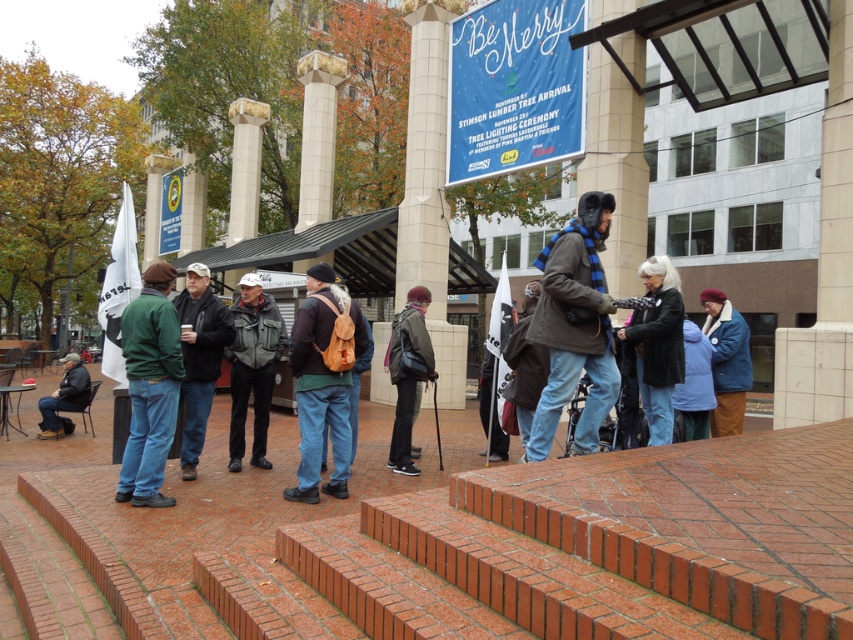
You are standing at the bottom of the brick steps and see the dark gray jacket at center and the blue woolen scarf at center. Which item is positioned to the left?

The dark gray jacket at center is to the left of the blue woolen scarf at center.

You are standing at the bottom of the brick steps and want to reach the covered area where the crowd is gathered. There is a beige stone pillar at center and a black jacket at center in your way. Which object is closer to you as you ascend the steps?

The black jacket at center is closer to you because the beige stone pillar at center is positioned over it, meaning the pillar is behind the jacket in the line of sight.